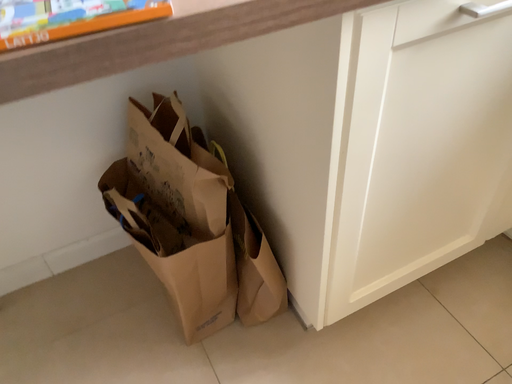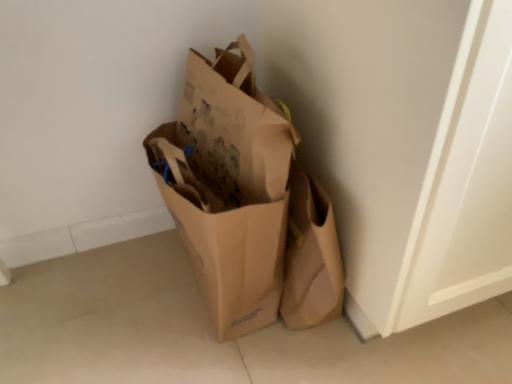
Question: How did the camera likely rotate when shooting the video?

Choices:
 (A) rotated downward
 (B) rotated upward

Answer: (B)